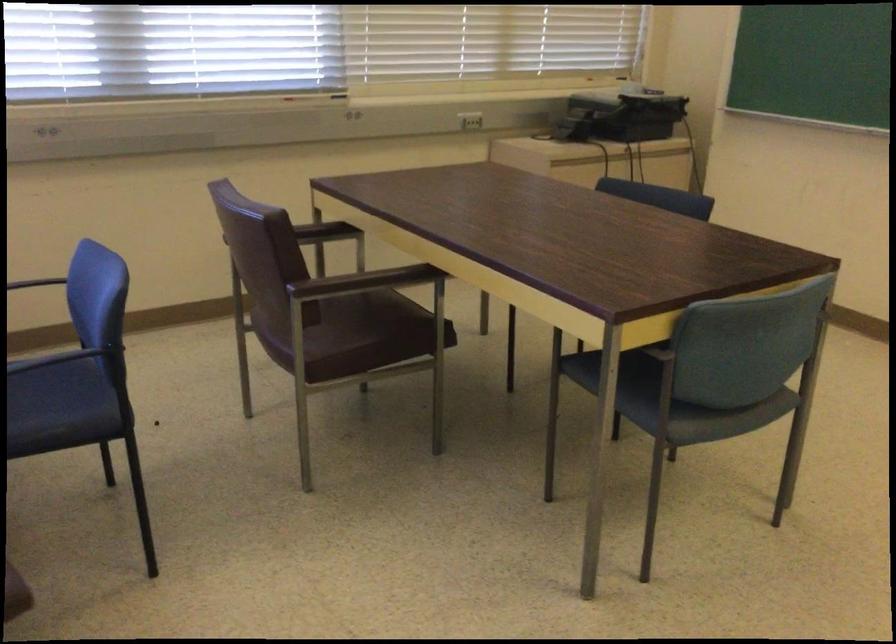
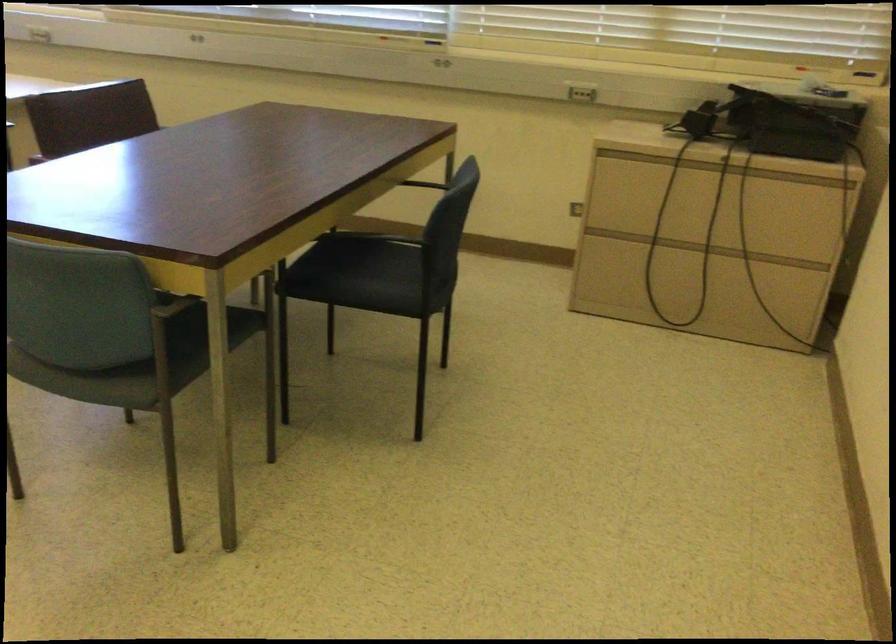
Question: I am providing you with two images of the same scene from different viewpoints. Which of the following objects are not visible in image2?

Choices:
 (A) glass jar with lid
 (B) green chair sitting surface
 (C) cabinet drawer handle
 (D) blue fabric sitting surface

Answer: (D)